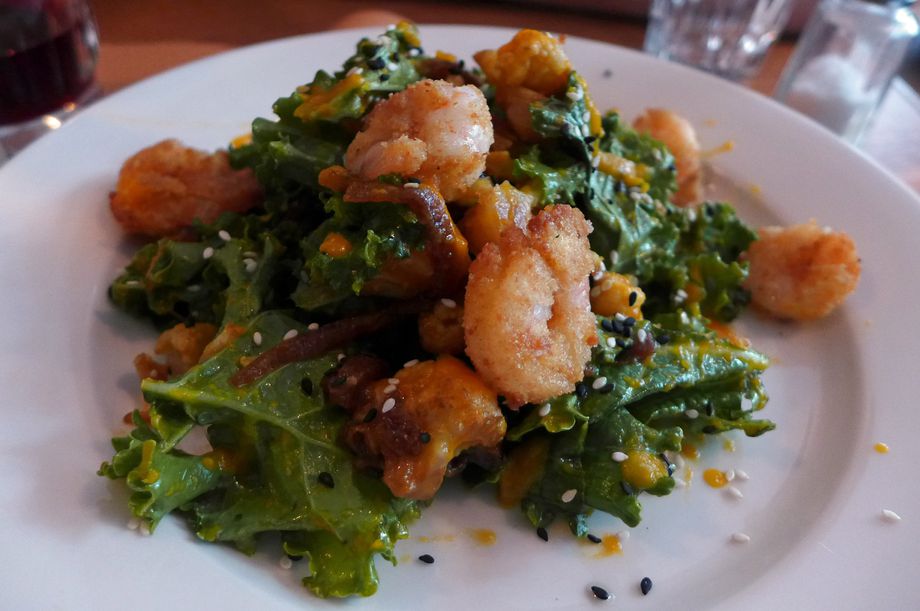
At what (x,y) coordinates should I click in order to perform the action: click on white plate. Please return your answer as a coordinate pair (x, y). Image resolution: width=920 pixels, height=611 pixels. Looking at the image, I should click on [831, 458].